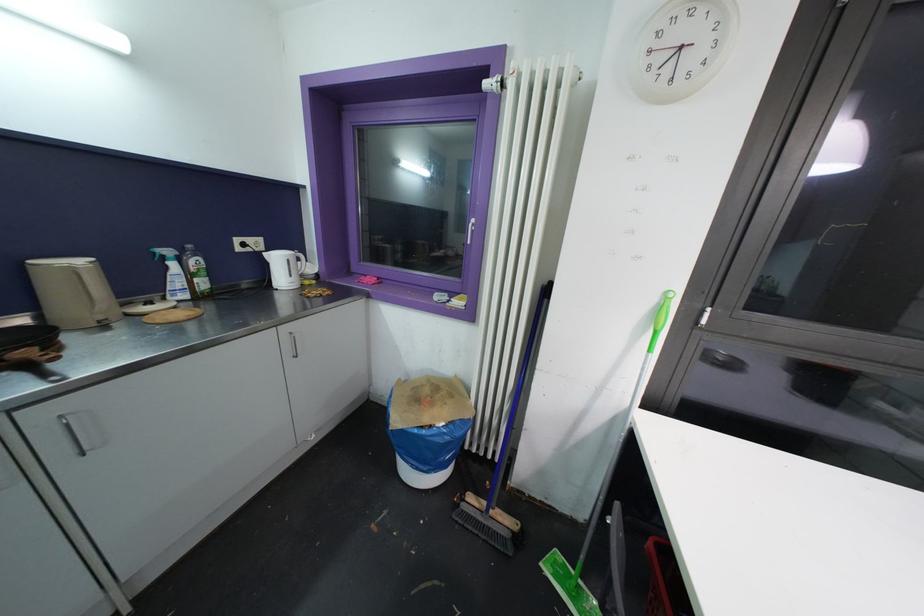
Where would you lift the green cleaning bottle? Please return your answer as a coordinate pair (x, y).

(172, 274)